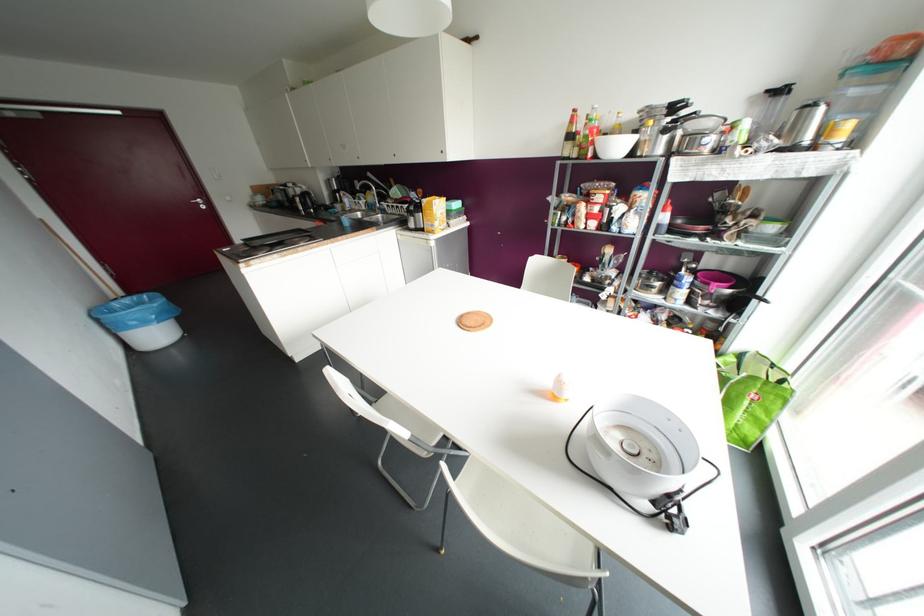
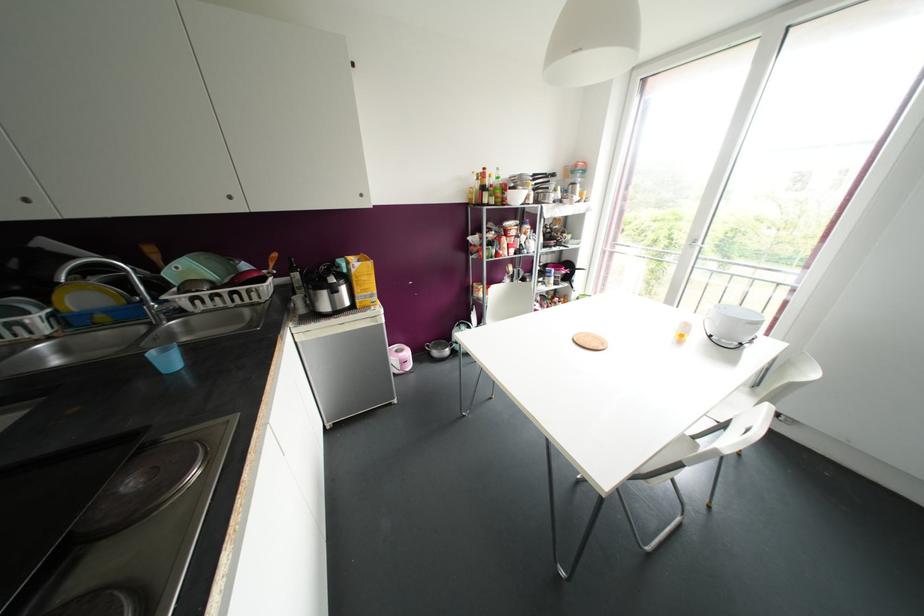
Question: I am providing you with two images of the same scene from different viewpoints. After the viewpoint changes to image2, which objects are now occluded?

Choices:
 (A) small blue cup
 (B) green tote bag
 (C) blue and black headphones
 (D) white door handle

Answer: (B)